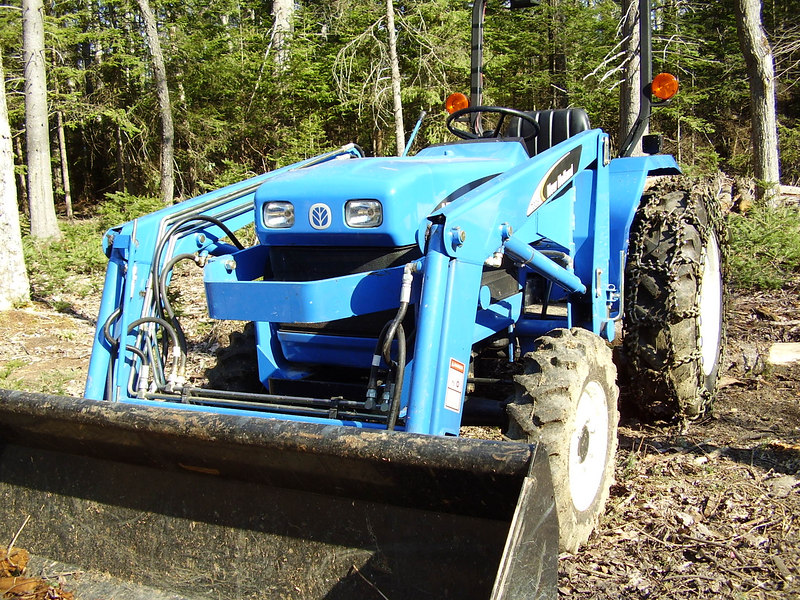
The height and width of the screenshot is (600, 800). I want to click on seat, so point(554,118).